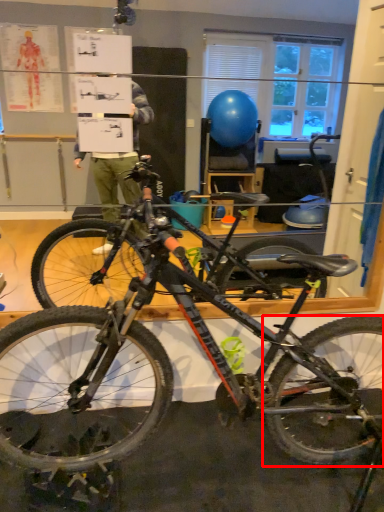
Question: From the image's perspective, where is bicycle wheel (annotated by the red box) located in relation to bicycle in the image?

Choices:
 (A) above
 (B) below

Answer: (B)